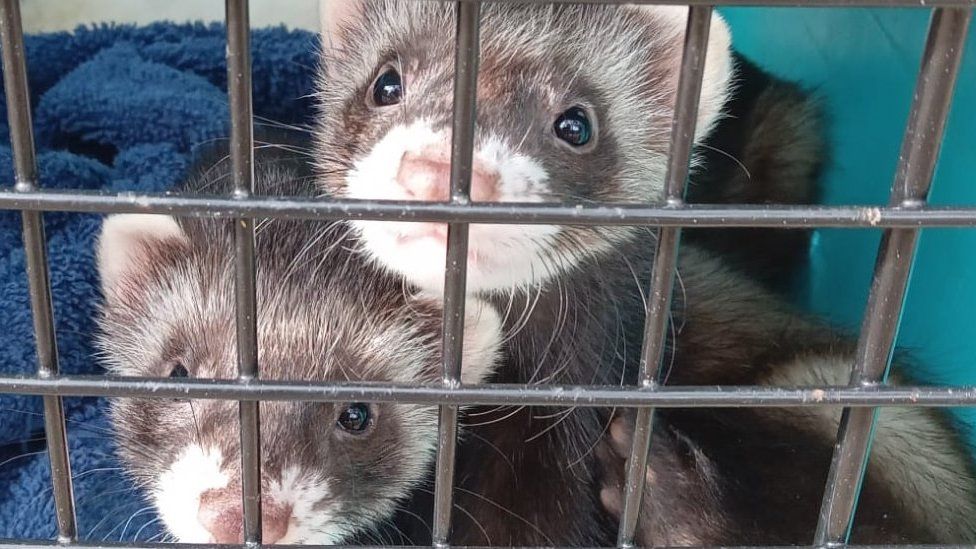
Identify the location of wall. (848, 19).